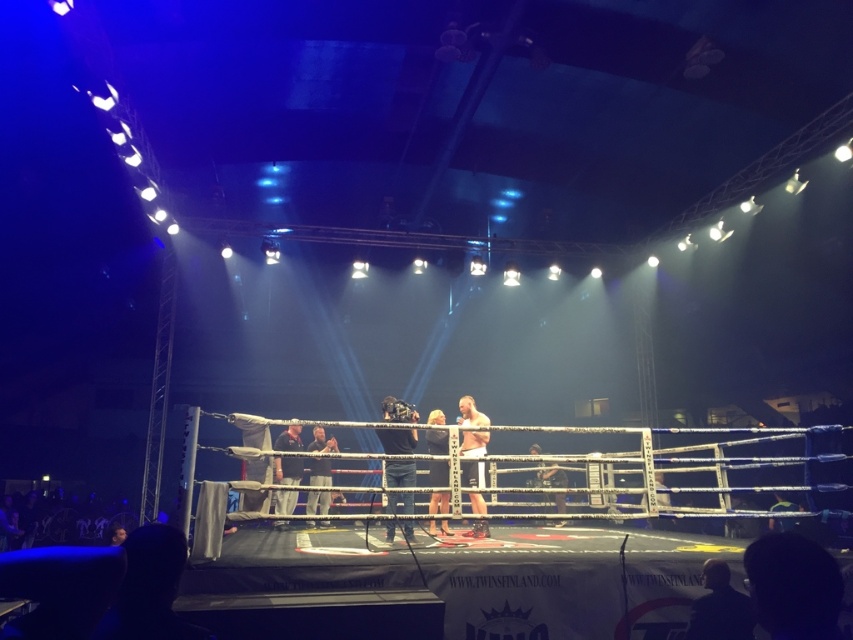
Question: Can you confirm if dark blue jeans at center is smaller than dark gray fabric at center?

Choices:
 (A) yes
 (B) no

Answer: (A)

Question: Which point is farther from the camera taking this photo?

Choices:
 (A) (x=485, y=442)
 (B) (x=564, y=481)
 (C) (x=302, y=464)

Answer: (B)

Question: Which object is the farthest from the dark gray fabric at center?

Choices:
 (A) smooth skin at center
 (B) dark brown leather jacket at center

Answer: (B)

Question: Based on their relative distances, which object is farther from the smooth skin at center?

Choices:
 (A) smooth skin person at center
 (B) dark gray fabric at center
 (C) smooth white shirt at center
 (D) dark blue jeans at center

Answer: (B)

Question: Is smooth skin person at center bigger than dark brown leather jacket at center?

Choices:
 (A) yes
 (B) no

Answer: (A)

Question: Is dark gray fabric at center positioned behind smooth skin at center?

Choices:
 (A) yes
 (B) no

Answer: (A)